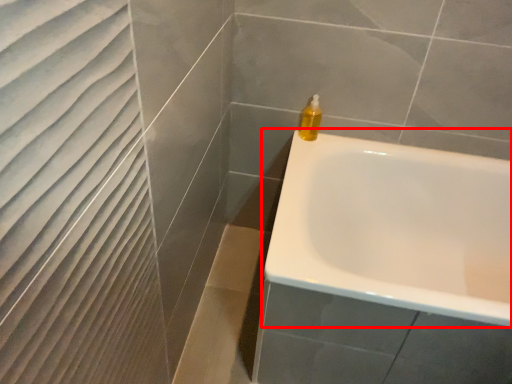
Question: From the image's perspective, considering the relative positions of bathtub (annotated by the red box) and soap dispenser in the image provided, where is bathtub (annotated by the red box) located with respect to the staircase?

Choices:
 (A) above
 (B) below

Answer: (B)